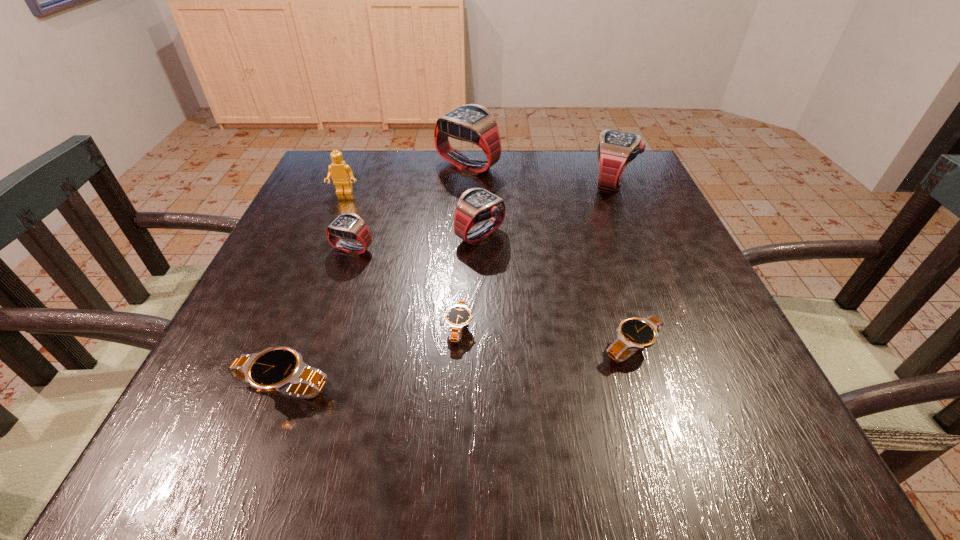
Find the location of a particular element. blank space at the far right corner of the desktop is located at coordinates (614, 196).

The image size is (960, 540). In order to click on vacant space at the near right corner in this screenshot , I will do `click(694, 419)`.

What are the coordinates of `vacant point located between the smallest black watch and the biggest red watch` in the screenshot? It's located at (464, 247).

Identify the location of free point between the fifth shortest watch and the second biggest red watch. (546, 208).

At what (x,y) coordinates should I click in order to perform the action: click on free space between the fourth shortest object and the biggest red watch. Please return your answer as a coordinate pair (x, y). Looking at the image, I should click on (410, 207).

This screenshot has height=540, width=960. I want to click on blank region between the biggest red watch and the third shortest watch, so click(x=375, y=277).

You are a GUI agent. You are given a task and a screenshot of the screen. Output one action in this format:
    pyautogui.click(x=<x>, y=<y>)
    Task: Click on the vacant point located between the tallest object and the Lego
    This screenshot has height=540, width=960.
    Given the screenshot: What is the action you would take?
    pyautogui.click(x=406, y=179)

Locate an element on the screen. This screenshot has width=960, height=540. free space between the third tallest watch and the Lego is located at coordinates 412,214.

This screenshot has height=540, width=960. I want to click on free space between the tallest watch and the shortest watch, so click(x=464, y=247).

You are a GUI agent. You are given a task and a screenshot of the screen. Output one action in this format:
    pyautogui.click(x=<x>, y=<y>)
    Task: Click on the empty location between the third tallest watch and the smallest black watch
    The image size is (960, 540).
    Given the screenshot: What is the action you would take?
    pyautogui.click(x=470, y=281)